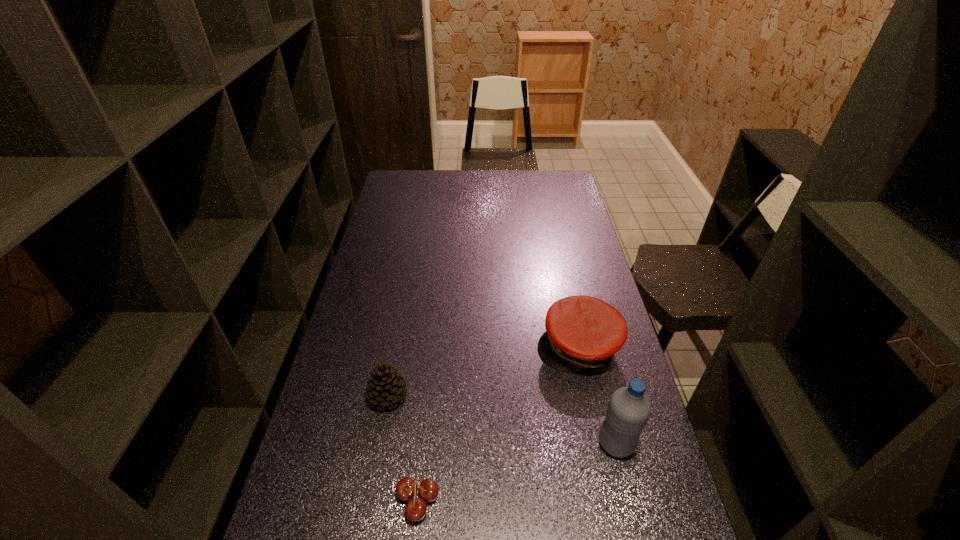
The height and width of the screenshot is (540, 960). Identify the location of free spot on the desktop that is between the cherry and the water bottle and is positioned at the front of the farthest object where the visor is located. (534, 465).

Locate an element on the screen. free space on the desktop that is between the shortest object and the tallest object and is positioned at the narrow end of the second farthest object is located at coordinates (540, 464).